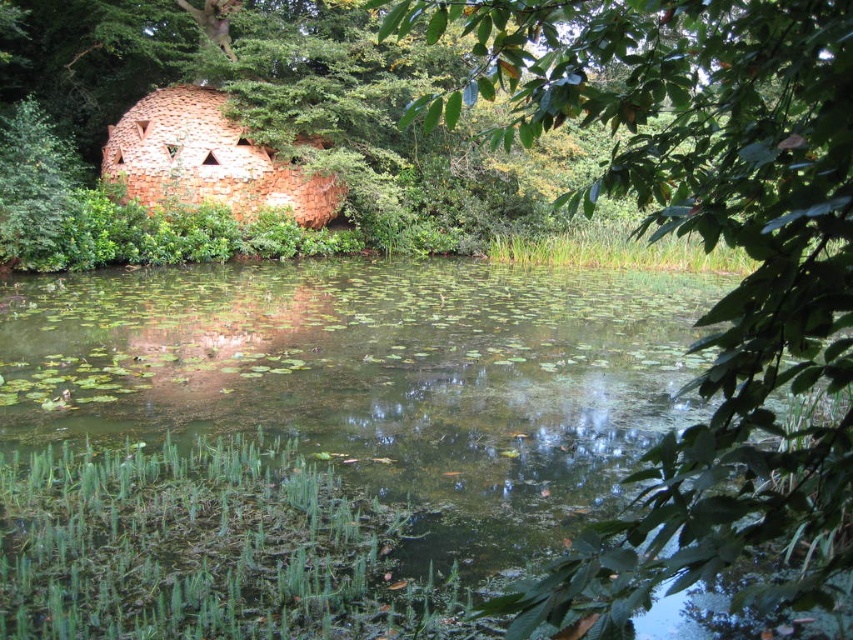
Question: Does green algae-covered water at center have a larger size compared to green leafy tree at upper right?

Choices:
 (A) yes
 (B) no

Answer: (B)

Question: Considering the relative positions of green algae-covered water at center and green leafy tree at upper right in the image provided, where is green algae-covered water at center located with respect to green leafy tree at upper right?

Choices:
 (A) below
 (B) above

Answer: (A)

Question: In this image, where is green algae-covered water at center located relative to green leafy tree at upper right?

Choices:
 (A) right
 (B) left

Answer: (B)

Question: Which point is closer to the camera taking this photo?

Choices:
 (A) (828, 113)
 (B) (26, 301)

Answer: (A)